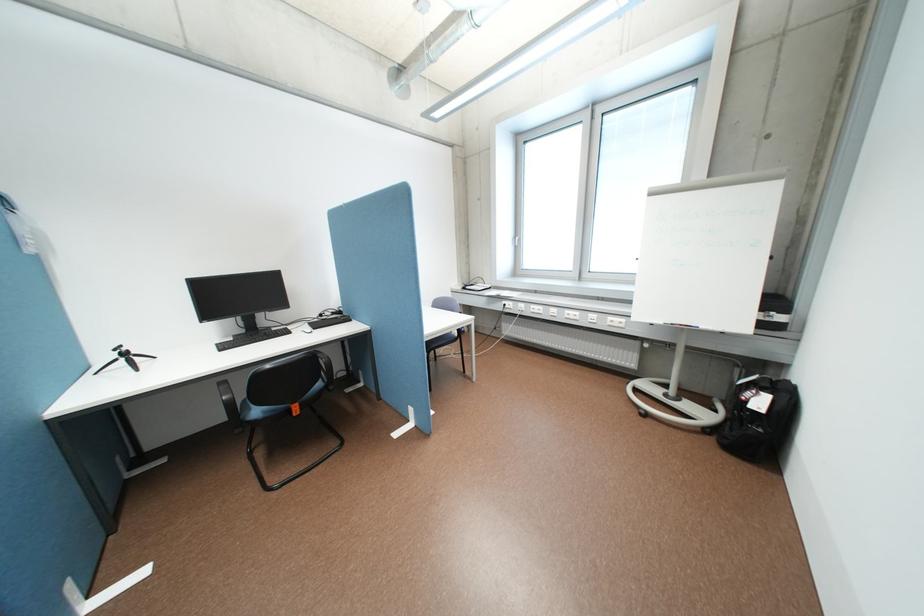
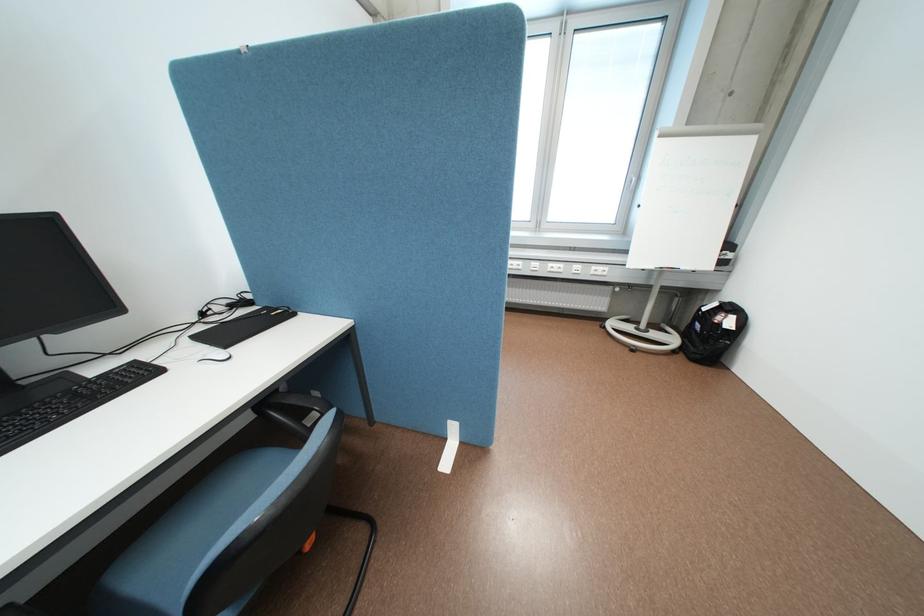
In the second image, find the point that corresponds to [621,318] in the first image.

(604, 267)